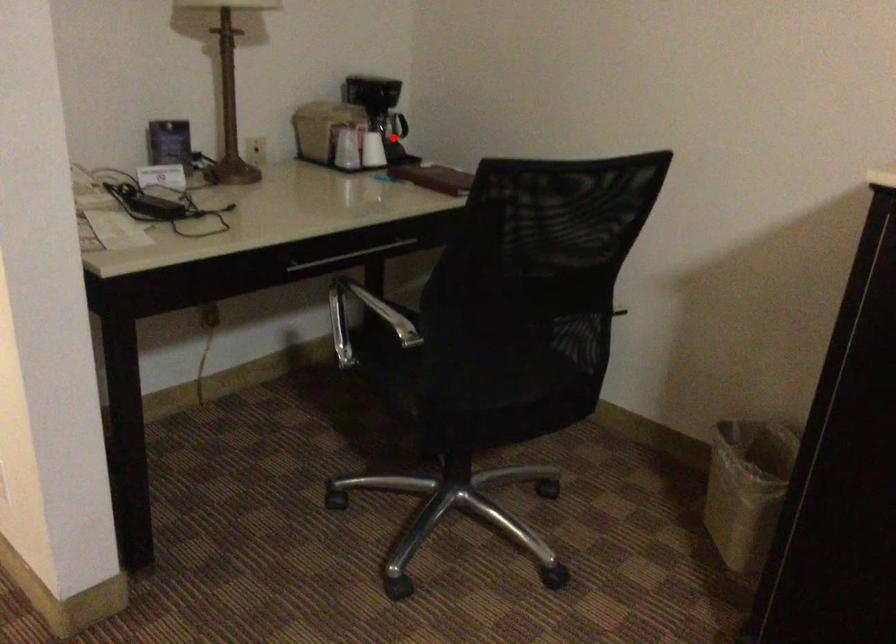
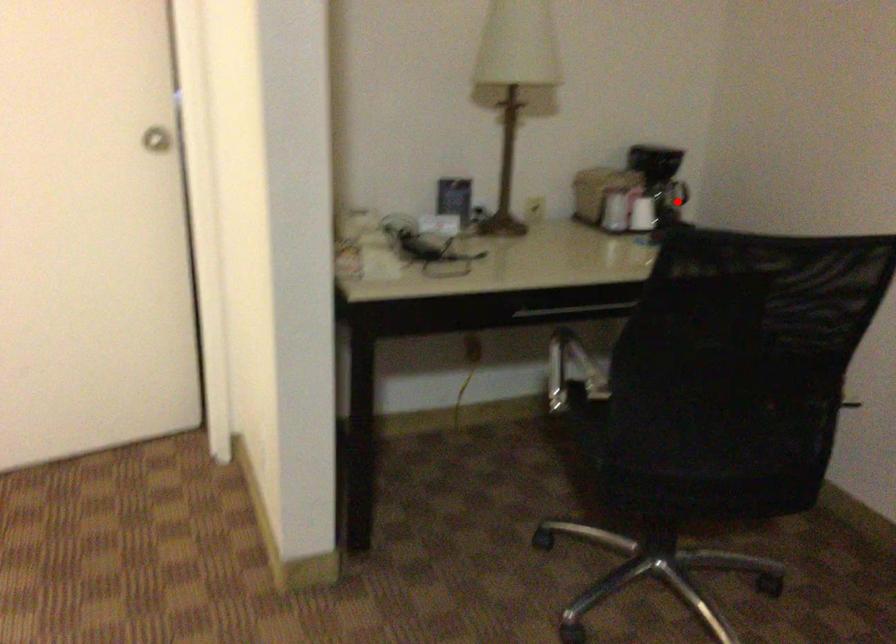
I am providing you with two images of the same scene from different viewpoints. A red point is marked on the first image and another point is marked on the second image. Is the red point in image1 aligned with the point shown in image2?

Yes